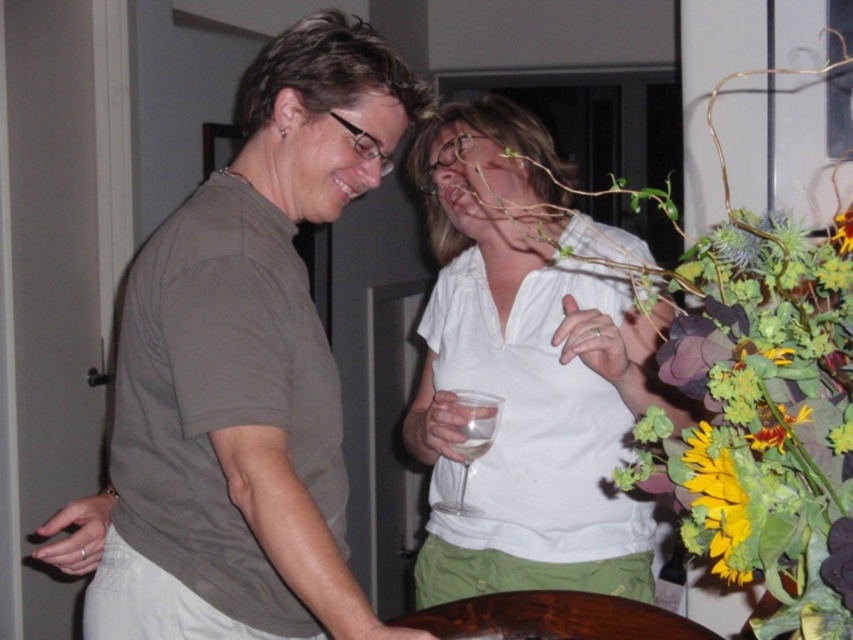
You are standing in the room where the two individuals are interacting. You need to place a small vase on the brown polished wood table at lower center. Based on the coordinates provided in the Objects Description, can you confirm if the table is positioned in the lower half of the room?

The brown polished wood table at lower center is located at point coordinates with a y value of 0.648. Since the coordinate system typically measures from the bottom as 0, a y value of 0.648 places it in the lower half of the room. Therefore, the table is indeed positioned in the lower half of the room.